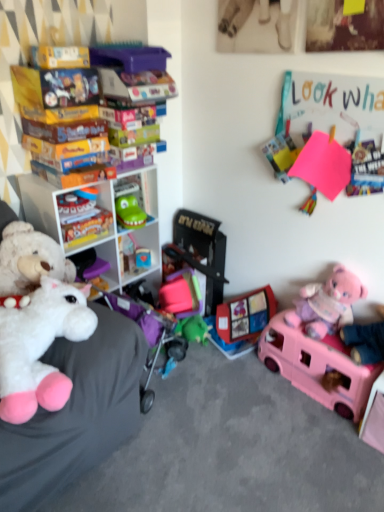
Question: Which direction should I rotate to face plastic toy car at center, which is counted as the third toy, starting from the right, — up or down?

Choices:
 (A) down
 (B) up

Answer: (A)

Question: From the image's perspective, is smooth plastic toy at center, the 4th toy when ordered from right to left, located above pink plastic toy car at lower right, positioned as the first toy in right-to-left order?

Choices:
 (A) yes
 (B) no

Answer: (A)

Question: Is smooth plastic toy at center, the 4th toy when ordered from right to left, oriented away from pink plastic toy car at lower right, positioned as the first toy in right-to-left order?

Choices:
 (A) no
 (B) yes

Answer: (A)

Question: Can you confirm if smooth plastic toy at center, which ranks as the second toy in left-to-right order, is positioned to the left of pink plastic toy car at lower right, which ranks as the fifth toy in left-to-right order?

Choices:
 (A) yes
 (B) no

Answer: (A)

Question: Does smooth plastic toy at center, which ranks as the second toy in left-to-right order, have a lesser height compared to pink plastic toy car at lower right, positioned as the first toy in right-to-left order?

Choices:
 (A) yes
 (B) no

Answer: (A)

Question: Considering the relative positions of smooth plastic toy at center, which ranks as the second toy in left-to-right order, and pink plastic toy car at lower right, positioned as the first toy in right-to-left order, in the image provided, is smooth plastic toy at center, which ranks as the second toy in left-to-right order, to the right of pink plastic toy car at lower right, positioned as the first toy in right-to-left order, from the viewer's perspective?

Choices:
 (A) yes
 (B) no

Answer: (B)

Question: From the image's perspective, is smooth plastic toy at center, which ranks as the second toy in left-to-right order, under pink plastic toy car at lower right, which ranks as the fifth toy in left-to-right order?

Choices:
 (A) no
 (B) yes

Answer: (A)

Question: Is white plastic shelf at left, placed as the second shelf when sorted from top to bottom, surrounding green plastic toy at center, which is the 1th shelf in top-to-bottom order?

Choices:
 (A) no
 (B) yes

Answer: (B)

Question: Is white plastic shelf at left, placed as the 1th shelf when sorted from bottom to top, at the left side of green plastic toy at center, which is the 2th shelf from bottom to top?

Choices:
 (A) no
 (B) yes

Answer: (B)

Question: Is white plastic shelf at left, placed as the second shelf when sorted from top to bottom, oriented away from green plastic toy at center, which is the 2th shelf from bottom to top?

Choices:
 (A) no
 (B) yes

Answer: (B)

Question: From the image's perspective, is white plastic shelf at left, placed as the 1th shelf when sorted from bottom to top, beneath green plastic toy at center, which is the 2th shelf from bottom to top?

Choices:
 (A) yes
 (B) no

Answer: (A)

Question: Is white plastic shelf at left, placed as the 1th shelf when sorted from bottom to top, far from green plastic toy at center, which is the 1th shelf in top-to-bottom order?

Choices:
 (A) no
 (B) yes

Answer: (A)

Question: Considering the relative sizes of white plastic shelf at left, placed as the 1th shelf when sorted from bottom to top, and green plastic toy at center, which is the 1th shelf in top-to-bottom order, in the image provided, is white plastic shelf at left, placed as the 1th shelf when sorted from bottom to top, taller than green plastic toy at center, which is the 1th shelf in top-to-bottom order,?

Choices:
 (A) no
 (B) yes

Answer: (B)

Question: Is white plastic shelf at left, placed as the 1th shelf when sorted from bottom to top, not within pink plastic toy car at lower right, which ranks as the fifth toy in left-to-right order?

Choices:
 (A) no
 (B) yes

Answer: (B)